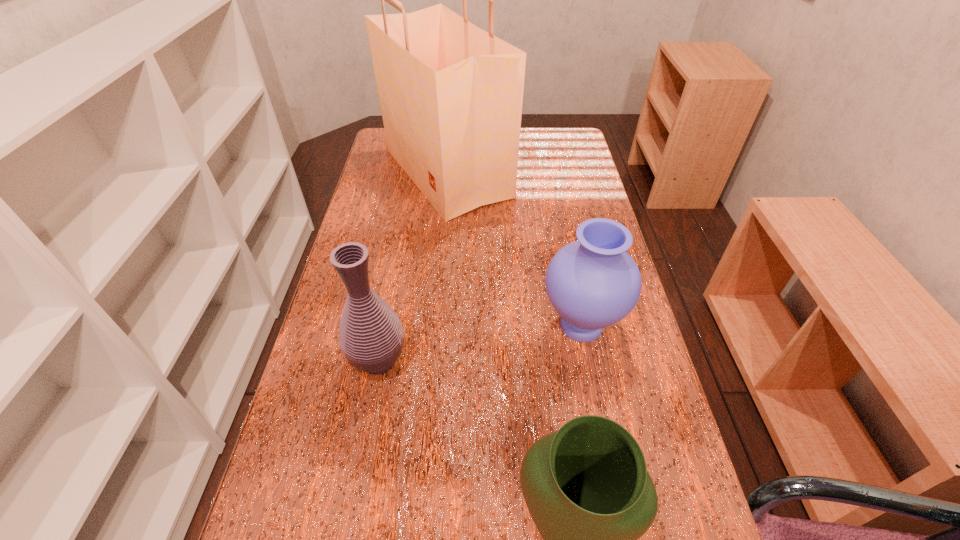
In the image, there is a desktop. In order to click on free region at the far edge in this screenshot , I will do 523,152.

Image resolution: width=960 pixels, height=540 pixels. In the image, there is a desktop. What are the coordinates of `free space at the left edge` in the screenshot? It's located at (356, 226).

Identify the location of vacant space at the right edge. Image resolution: width=960 pixels, height=540 pixels. [568, 171].

In the image, there is a desktop. At what (x,y) coordinates should I click in order to perform the action: click on blank space at the far right corner. Please return your answer as a coordinate pair (x, y). Looking at the image, I should click on (578, 158).

Locate an element on the screen. This screenshot has height=540, width=960. vacant space in between the tallest object and the leftmost vase is located at coordinates (413, 267).

Find the location of a particular element. This screenshot has height=540, width=960. object that is the third closest to the grocery bag is located at coordinates (586, 486).

Locate an element on the screen. This screenshot has width=960, height=540. the second closest object to the leftmost vase is located at coordinates (592, 283).

Where is `the second closest vase relative to the nearest vase`? The image size is (960, 540). the second closest vase relative to the nearest vase is located at coordinates (371, 336).

I want to click on vase identified as the second closest to the grocery bag, so click(x=371, y=336).